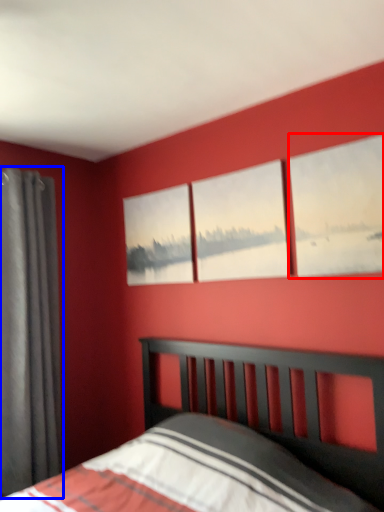
Question: Which point is further to the camera, window (highlighted by a red box) or curtain (highlighted by a blue box)?

Choices:
 (A) window
 (B) curtain

Answer: (B)